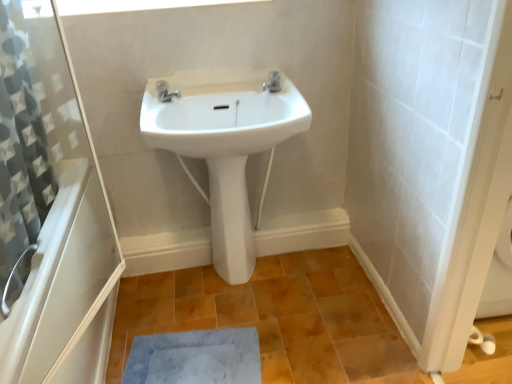
Question: Does white ceramic sink at center turn towards white glossy bidet at center?

Choices:
 (A) no
 (B) yes

Answer: (A)

Question: From the image's perspective, is white ceramic sink at center located beneath white glossy bidet at center?

Choices:
 (A) yes
 (B) no

Answer: (B)

Question: Is white glossy bidet at center a part of white ceramic sink at center?

Choices:
 (A) no
 (B) yes

Answer: (A)

Question: Considering the relative sizes of white ceramic sink at center and white glossy bidet at center in the image provided, is white ceramic sink at center taller than white glossy bidet at center?

Choices:
 (A) yes
 (B) no

Answer: (B)

Question: From a real-world perspective, does white ceramic sink at center sit lower than white glossy bidet at center?

Choices:
 (A) yes
 (B) no

Answer: (B)

Question: In the image, is white glossy bidet at center on the left side or the right side of blue fuzzy mat at lower center?

Choices:
 (A) left
 (B) right

Answer: (B)

Question: Considering the positions of white glossy bidet at center and blue fuzzy mat at lower center in the image, is white glossy bidet at center taller or shorter than blue fuzzy mat at lower center?

Choices:
 (A) tall
 (B) short

Answer: (A)

Question: Based on their sizes in the image, would you say white glossy bidet at center is bigger or smaller than blue fuzzy mat at lower center?

Choices:
 (A) small
 (B) big

Answer: (B)

Question: Considering the positions of point (233, 195) and point (245, 369), is point (233, 195) closer or farther from the camera than point (245, 369)?

Choices:
 (A) closer
 (B) farther

Answer: (B)

Question: In terms of width, does white glossy bath at lower left look wider or thinner when compared to polished chrome tap at upper center, the 1th tap in the left-to-right sequence?

Choices:
 (A) thin
 (B) wide

Answer: (B)

Question: From their relative heights in the image, would you say white glossy bath at lower left is taller or shorter than polished chrome tap at upper center, the 1th tap in the left-to-right sequence?

Choices:
 (A) short
 (B) tall

Answer: (B)

Question: From the image's perspective, is white glossy bath at lower left above or below polished chrome tap at upper center, the second tap positioned from the right?

Choices:
 (A) below
 (B) above

Answer: (A)

Question: Is point (55, 304) closer or farther from the camera than point (156, 84)?

Choices:
 (A) farther
 (B) closer

Answer: (B)

Question: Based on their positions, is white glossy bidet at center located to the left or right of satin nickel faucet at center, the second tap when ordered from left to right?

Choices:
 (A) right
 (B) left

Answer: (B)

Question: Based on their sizes in the image, would you say white glossy bidet at center is bigger or smaller than satin nickel faucet at center, the second tap when ordered from left to right?

Choices:
 (A) big
 (B) small

Answer: (A)